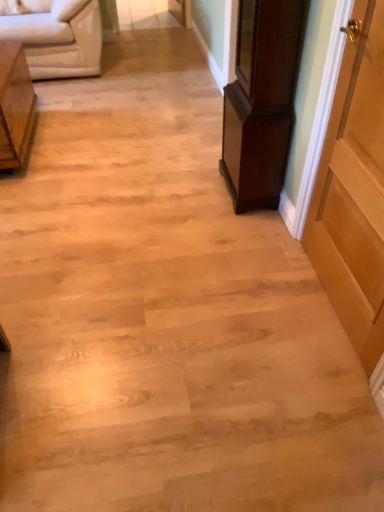
Image resolution: width=384 pixels, height=512 pixels. I want to click on vacant space situated on the left part of light brown wood door at right, so 238,304.